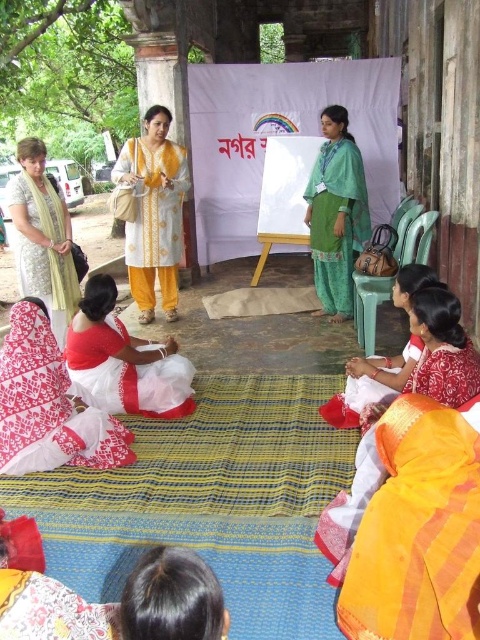
Question: Which point is farther to the camera?

Choices:
 (A) white printed saree at lower left
 (B) silky orange saree at lower right
 (C) white cotton saree at lower left
 (D) green cotton kurta at center

Answer: (D)

Question: Which object is the farthest from the light green silk saree at left?

Choices:
 (A) white cotton kurta at center
 (B) green cotton kurta at center
 (C) white cotton saree at lower right

Answer: (C)

Question: Where is silky orange saree at lower right located in relation to white cotton saree at lower right in the image?

Choices:
 (A) below
 (B) above

Answer: (A)

Question: Which of the following is the farthest from the observer?

Choices:
 (A) green cotton kurta at center
 (B) silky orange saree at lower right
 (C) light green silk saree at left

Answer: (A)

Question: Can you confirm if orange silk sari at lower right is positioned below light green silk saree at left?

Choices:
 (A) no
 (B) yes

Answer: (B)

Question: Can you confirm if white cotton saree at lower left is bigger than light green silk saree at left?

Choices:
 (A) no
 (B) yes

Answer: (B)